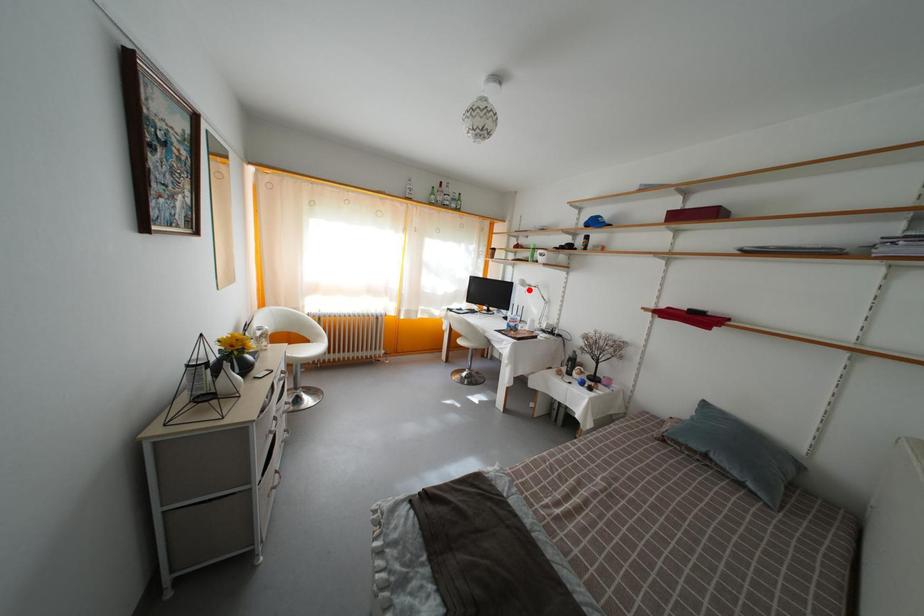
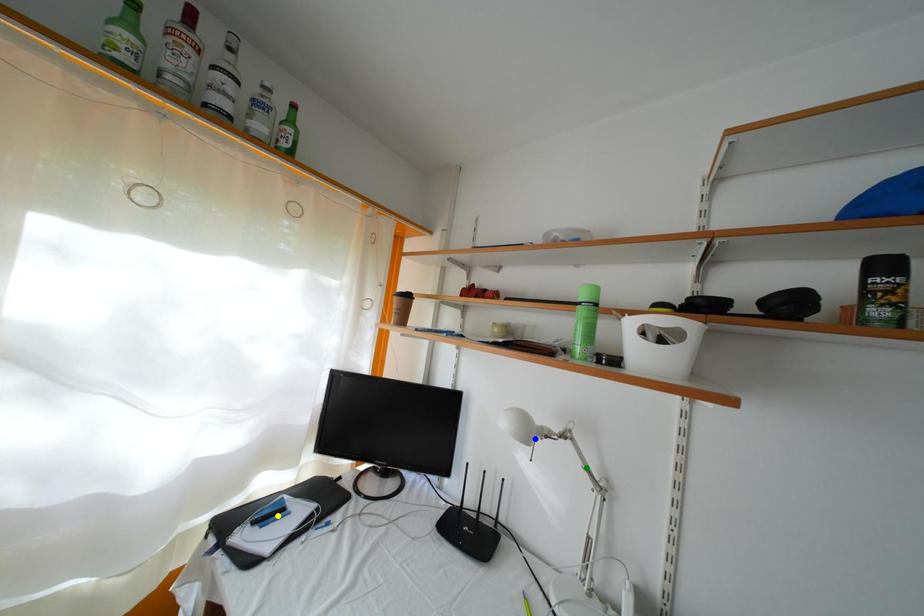
Question: I am providing you with two images of the same scene from different viewpoints. A red point is marked on the first image. You are given multiple points on the second image. Which point in image 2 is actually the same real-world point as the red point in image 1?

Choices:
 (A) yellow point
 (B) green point
 (C) blue point

Answer: (C)